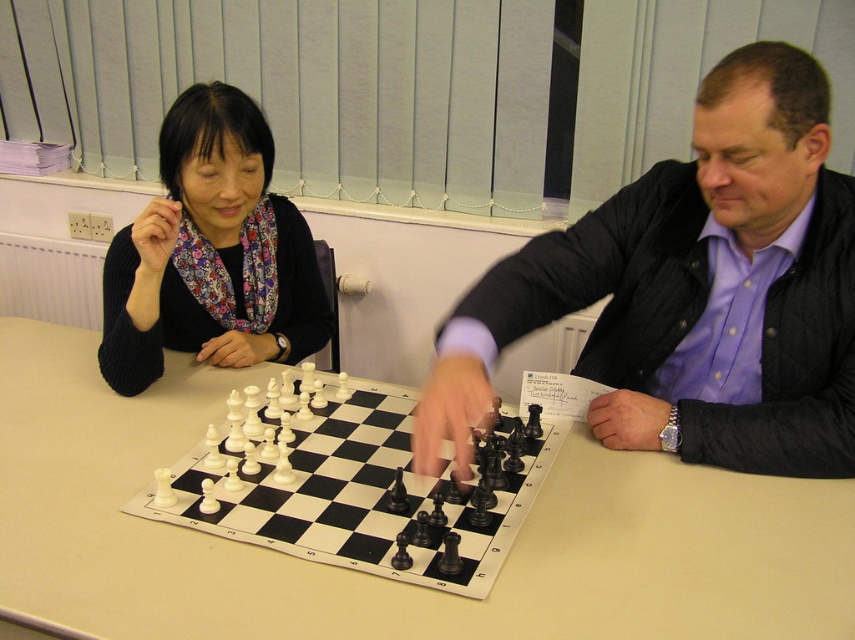
Question: Which of these objects is positioned farthest from the white plastic table at center?

Choices:
 (A) white plastic chess pieces at center
 (B) matte black sweater at upper left
 (C) matte black jacket at center

Answer: (C)

Question: Which point is closer to the camera?

Choices:
 (A) (614, 618)
 (B) (258, 253)
 (C) (736, 177)

Answer: (A)

Question: Does matte black jacket at center appear over white plastic chess pieces at center?

Choices:
 (A) no
 (B) yes

Answer: (B)

Question: Is white plastic table at center smaller than white plastic chess pieces at center?

Choices:
 (A) no
 (B) yes

Answer: (A)

Question: Is matte black jacket at center wider than matte black sweater at upper left?

Choices:
 (A) no
 (B) yes

Answer: (B)

Question: Which point is farther from the camera taking this photo?

Choices:
 (A) (793, 349)
 (B) (260, 131)
 (C) (726, 538)
 (D) (423, 500)

Answer: (B)